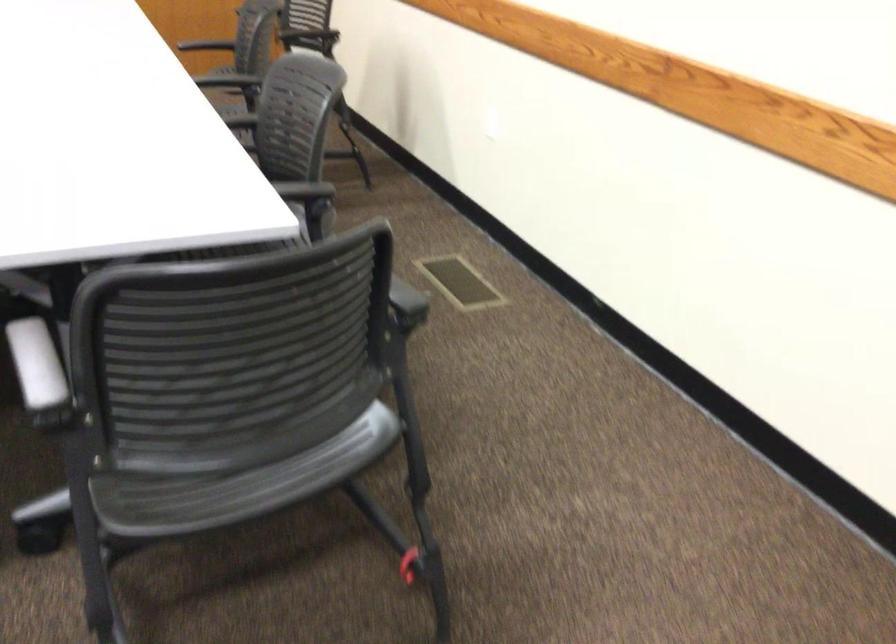
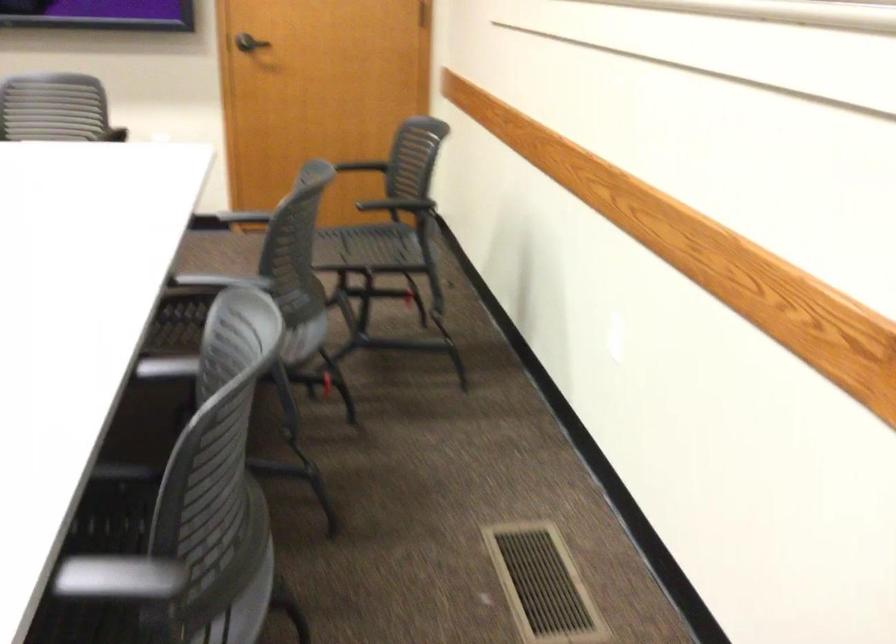
The point at (296, 192) is marked in the first image. Where is the corresponding point in the second image?

(118, 578)